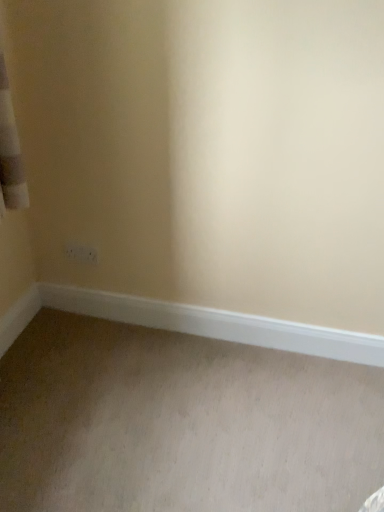
You are a GUI agent. You are given a task and a screenshot of the screen. Output one action in this format:
    pyautogui.click(x=<x>, y=<y>)
    Task: Click on the vacant area on top of beige carpet at lower left (from a real-world perspective)
    The height and width of the screenshot is (512, 384).
    Given the screenshot: What is the action you would take?
    pyautogui.click(x=159, y=423)